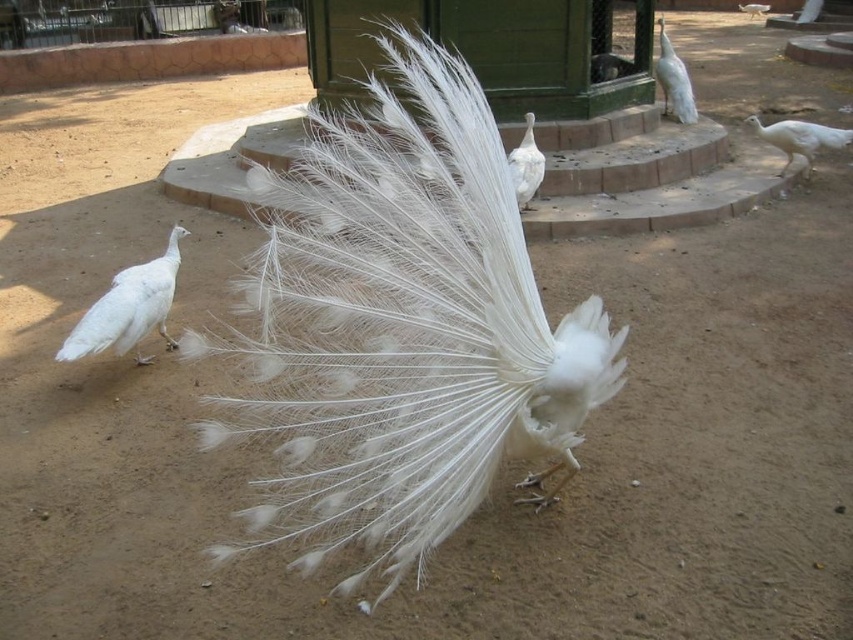
You are a zookeeper who needs to feed the white feathered peacock at left and the white feathered peacock at right. Based on their positions, which one is closer to the ground?

The white feathered peacock at left is located below the white feathered peacock at right, so it is closer to the ground.